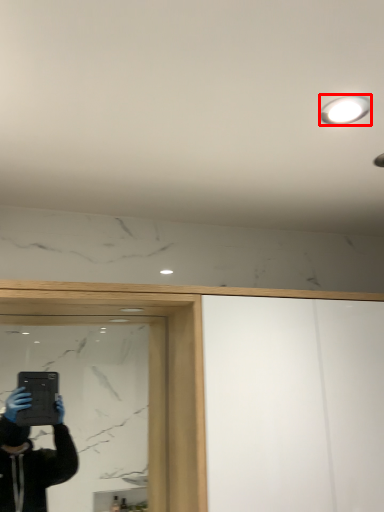
Question: From the image's perspective, where is light fixture (annotated by the red box) located in relation to mirror in the image?

Choices:
 (A) below
 (B) above

Answer: (B)